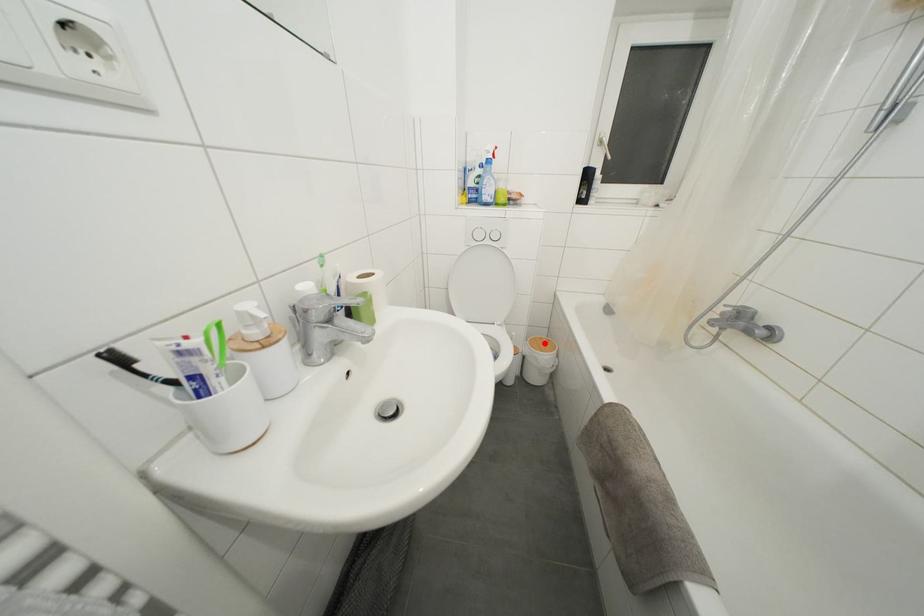
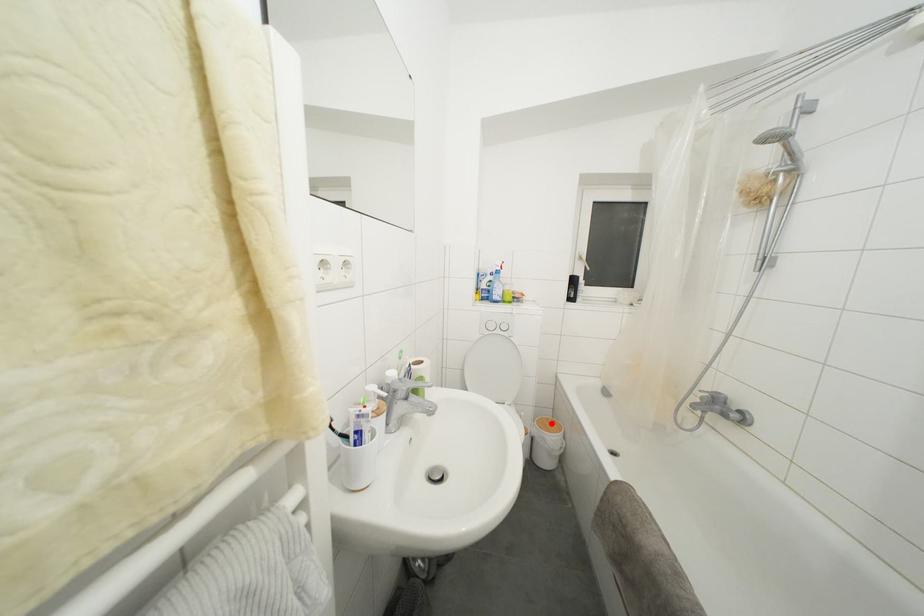
I am providing you with two images of the same scene from different viewpoints. A red point is marked on the first image and another point is marked on the second image. Is the red point in image1 aligned with the point shown in image2?

Yes